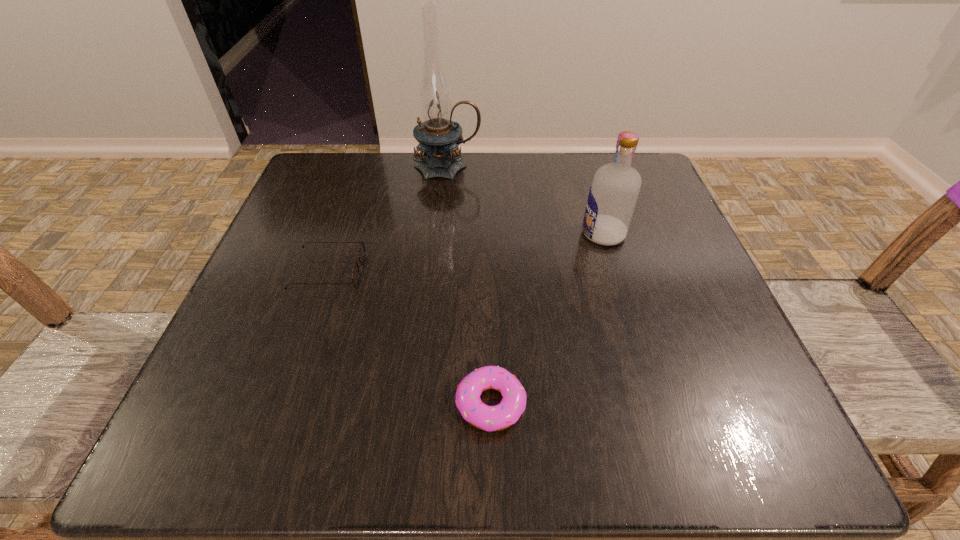
Identify the location of free spot between the doughnut and the sunglasses. (410, 338).

Locate an element on the screen. Image resolution: width=960 pixels, height=540 pixels. vacant space in between the nearest object and the third farthest object is located at coordinates (410, 338).

This screenshot has height=540, width=960. What are the coordinates of `free spot between the farthest object and the sunglasses` in the screenshot? It's located at (388, 219).

Where is `object identified as the third closest to the tallest object`? The image size is (960, 540). object identified as the third closest to the tallest object is located at coordinates (489, 418).

Choose which object is the third nearest neighbor to the leftmost object. Please provide its 2D coordinates. Your answer should be formatted as a tuple, i.e. [(x, y)], where the tuple contains the x and y coordinates of a point satisfying the conditions above.

[(613, 194)]

I want to click on vacant region that satisfies the following two spatial constraints: 1. on the front-facing side of the nearest object; 2. on the left side of the third farthest object, so click(285, 404).

I want to click on vacant space that satisfies the following two spatial constraints: 1. on the front-facing side of the second nearest object; 2. on the back side of the doughnut, so click(285, 404).